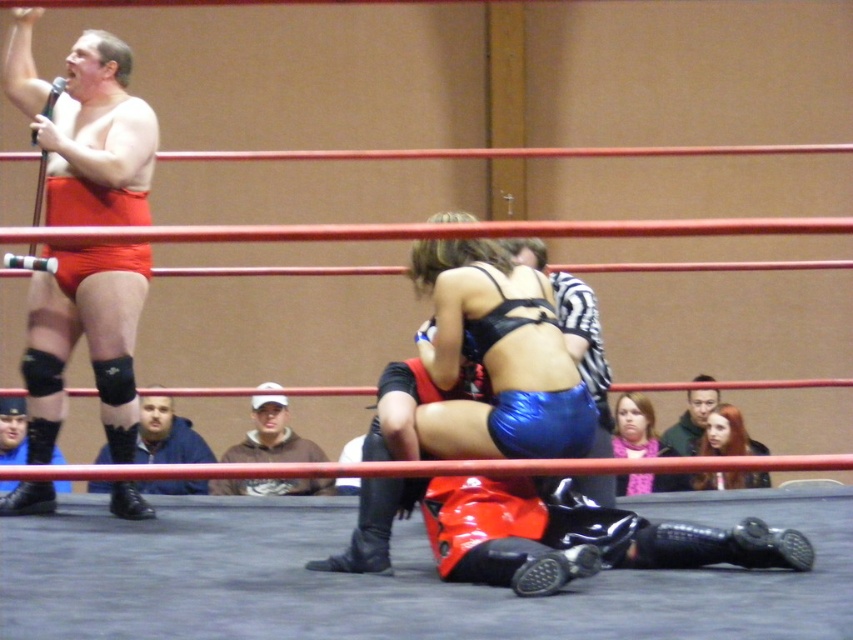
Question: Which object is positioned farthest from the smooth black jacket at upper center?

Choices:
 (A) matte black boots at lower left
 (B) shiny blue shorts at center
 (C) blue fabric jacket at lower left

Answer: (A)

Question: Which of the following is the farthest from the observer?

Choices:
 (A) (300, 477)
 (B) (724, 408)
 (C) (51, 449)

Answer: (B)

Question: Does shiny blue shorts at center appear on the left side of brown cotton hoodie at center?

Choices:
 (A) yes
 (B) no

Answer: (B)

Question: Does matte red shorts at upper left come in front of brown cotton hoodie at center?

Choices:
 (A) yes
 (B) no

Answer: (A)

Question: Which of the following is the farthest from the observer?

Choices:
 (A) (631, 432)
 (B) (109, 284)
 (C) (242, 492)
 (D) (593, 387)

Answer: (A)

Question: Can you confirm if matte red shorts at upper left is thinner than blue fabric jacket at lower left?

Choices:
 (A) no
 (B) yes

Answer: (B)